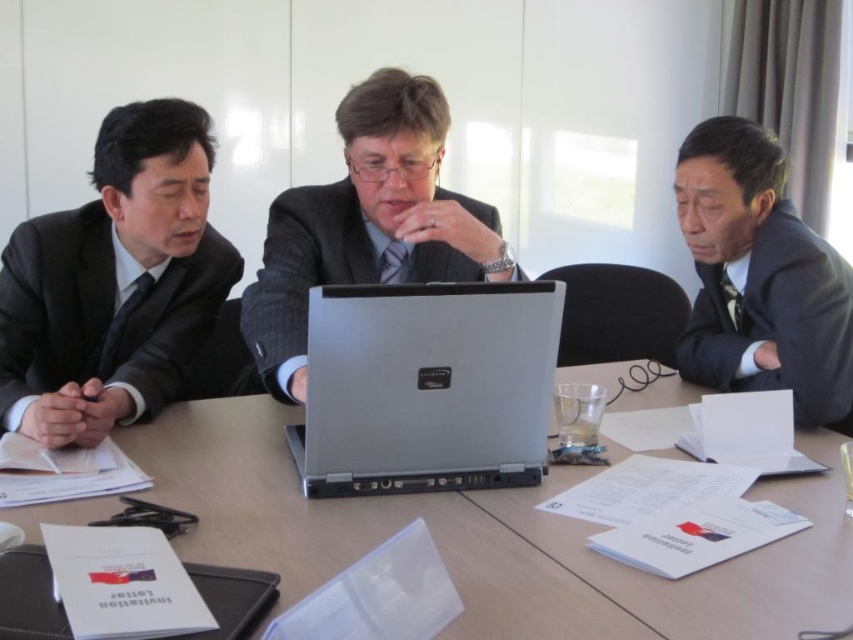
Is silver metallic laptop at center positioned in front of dark gray suit at right?

Yes, silver metallic laptop at center is closer to the viewer.

Which is behind, point (548, 285) or point (795, 257)?

The point (795, 257) is more distant.

The image size is (853, 640). Find the location of `silver metallic laptop at center`. silver metallic laptop at center is located at coordinates (426, 387).

Between silver metallic laptop at center and dark gray matte suit at left, which one appears on the right side from the viewer's perspective?

Positioned to the right is silver metallic laptop at center.

Can you confirm if silver metallic laptop at center is thinner than dark gray matte suit at left?

No, silver metallic laptop at center is not thinner than dark gray matte suit at left.

Identify the location of silver metallic laptop at center. This screenshot has height=640, width=853. (426, 387).

You are a GUI agent. You are given a task and a screenshot of the screen. Output one action in this format:
    pyautogui.click(x=<x>, y=<y>)
    Task: Click on the silver metallic laptop at center
    The width and height of the screenshot is (853, 640).
    Given the screenshot: What is the action you would take?
    pyautogui.click(x=426, y=387)

Who is higher up, dark gray suit at right or gray woolen suit at center?

gray woolen suit at center is higher up.

Is dark gray suit at right to the right of gray woolen suit at center from the viewer's perspective?

Indeed, dark gray suit at right is positioned on the right side of gray woolen suit at center.

Image resolution: width=853 pixels, height=640 pixels. In order to click on dark gray suit at right in this screenshot , I will do `click(776, 321)`.

The width and height of the screenshot is (853, 640). I want to click on dark gray suit at right, so click(776, 321).